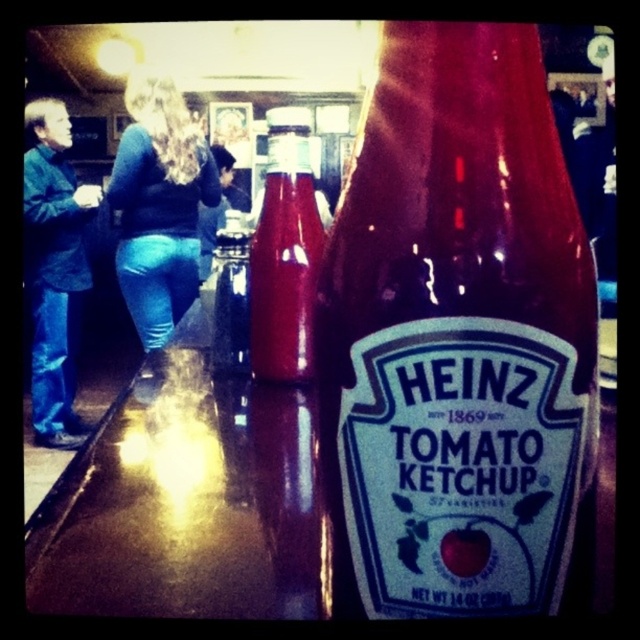
Question: Which object is the closest to the translucent glass bottle at center?

Choices:
 (A) blue jeans at lower left
 (B) jeans at left
 (C) matte glass bottle at center

Answer: (C)

Question: Which object is positioned closest to the matte glass bottle at center?

Choices:
 (A) blue jeans at left
 (B) translucent glass bottle at center

Answer: (B)

Question: Which of the following is the closest to the observer?

Choices:
 (A) jeans at left
 (B) matte glass bottle at center
 (C) blue jeans at lower left
 (D) blue jeans at left

Answer: (B)

Question: Does blue jeans at left have a smaller size compared to matte glass bottle at center?

Choices:
 (A) no
 (B) yes

Answer: (A)

Question: Can you confirm if translucent glass bottle at center is smaller than blue jeans at lower left?

Choices:
 (A) no
 (B) yes

Answer: (B)

Question: Is blue jeans at left above matte glass bottle at center?

Choices:
 (A) yes
 (B) no

Answer: (A)